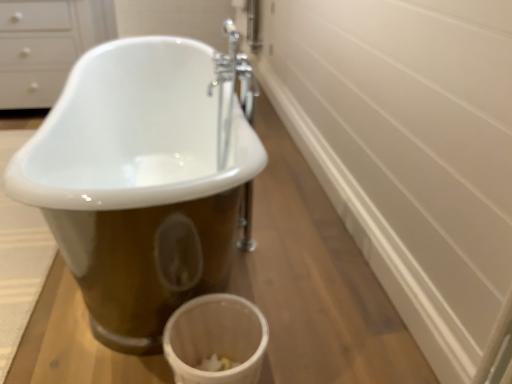
The width and height of the screenshot is (512, 384). I want to click on vacant space underneath chrome metallic faucet at center (from a real-world perspective), so click(234, 231).